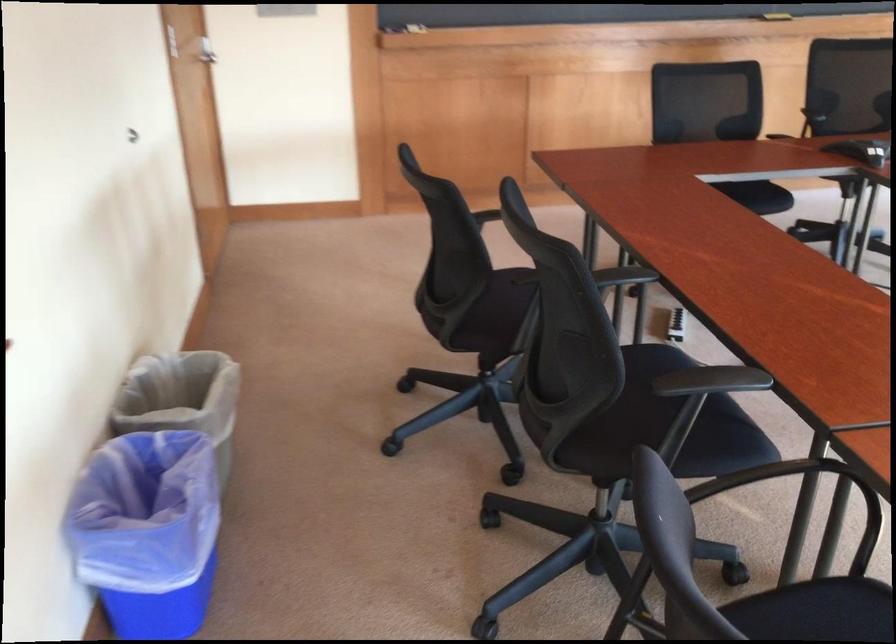
At what (x,y) coordinates should I click in order to perform the action: click on silver door handle. Please return your answer as a coordinate pair (x, y). Image resolution: width=896 pixels, height=644 pixels. Looking at the image, I should click on tap(205, 51).